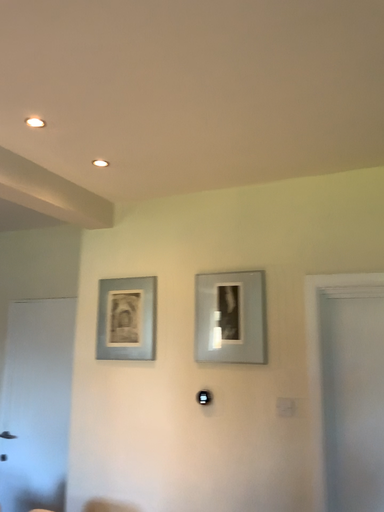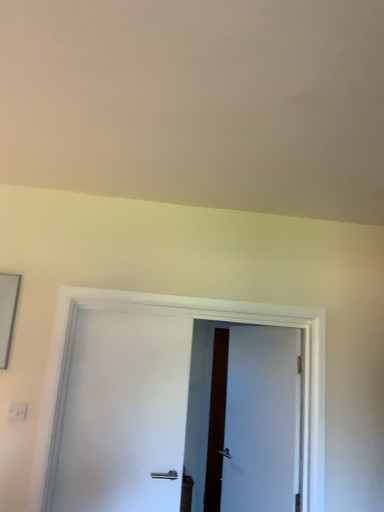
Question: Which way did the camera rotate in the video?

Choices:
 (A) rotated right
 (B) rotated left

Answer: (A)